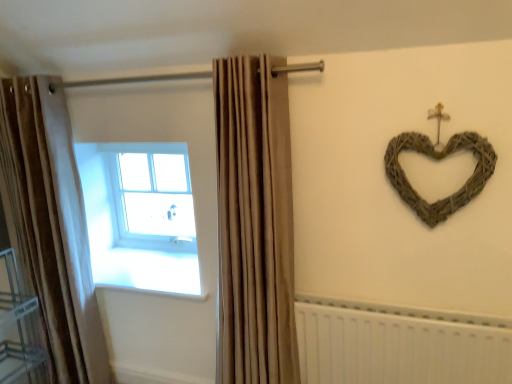
Question: Is woven natural heart at upper right positioned beyond the bounds of beige fabric curtain at center, which appears as the 2th curtain when viewed from the left?

Choices:
 (A) no
 (B) yes

Answer: (B)

Question: Is the depth of woven natural heart at upper right greater than that of beige fabric curtain at center, which ranks as the first curtain in right-to-left order?

Choices:
 (A) no
 (B) yes

Answer: (A)

Question: Is woven natural heart at upper right wider than beige fabric curtain at center, which ranks as the first curtain in right-to-left order?

Choices:
 (A) no
 (B) yes

Answer: (A)

Question: From the image's perspective, is woven natural heart at upper right beneath beige fabric curtain at center, which ranks as the first curtain in right-to-left order?

Choices:
 (A) no
 (B) yes

Answer: (A)

Question: Is there a large distance between woven natural heart at upper right and beige fabric curtain at center, which appears as the 2th curtain when viewed from the left?

Choices:
 (A) no
 (B) yes

Answer: (A)

Question: Considering the relative sizes of woven natural heart at upper right and beige fabric curtain at center, which appears as the 2th curtain when viewed from the left, in the image provided, is woven natural heart at upper right smaller than beige fabric curtain at center, which appears as the 2th curtain when viewed from the left,?

Choices:
 (A) no
 (B) yes

Answer: (B)

Question: Would you say metallic silver shelf at lower left contains white plastic radiator at lower right?

Choices:
 (A) no
 (B) yes

Answer: (A)

Question: Considering the relative sizes of metallic silver shelf at lower left and white plastic radiator at lower right in the image provided, is metallic silver shelf at lower left wider than white plastic radiator at lower right?

Choices:
 (A) no
 (B) yes

Answer: (B)

Question: From a real-world perspective, is metallic silver shelf at lower left physically below white plastic radiator at lower right?

Choices:
 (A) yes
 (B) no

Answer: (B)

Question: Is metallic silver shelf at lower left not near white plastic radiator at lower right?

Choices:
 (A) no
 (B) yes

Answer: (B)

Question: Is metallic silver shelf at lower left facing towards white plastic radiator at lower right?

Choices:
 (A) no
 (B) yes

Answer: (B)

Question: Can you confirm if metallic silver shelf at lower left is taller than white plastic radiator at lower right?

Choices:
 (A) no
 (B) yes

Answer: (B)

Question: Is white glass window at upper left oriented towards woven natural heart at upper right?

Choices:
 (A) no
 (B) yes

Answer: (A)